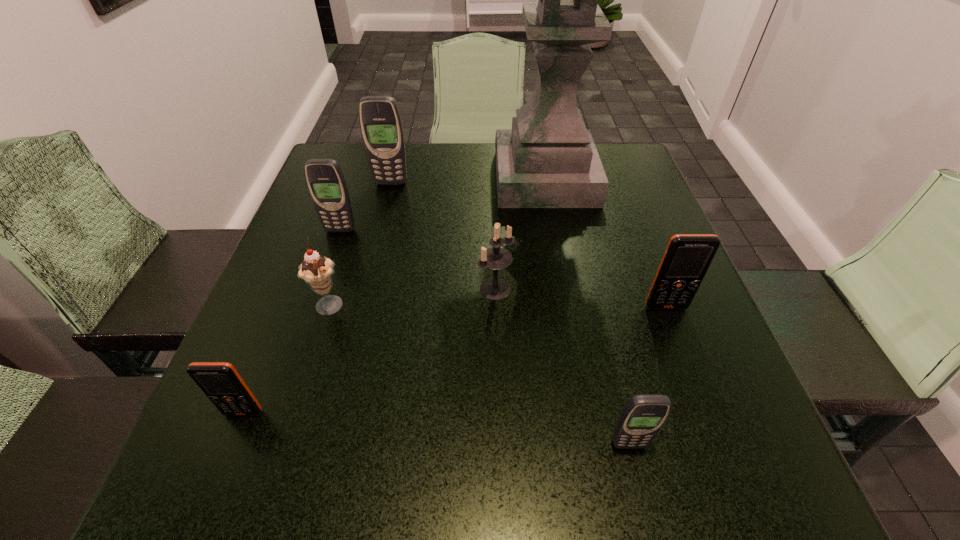
At what (x,y) coordinates should I click in order to perform the action: click on the left orange cellular telephone. Please return your answer as a coordinate pair (x, y). The width and height of the screenshot is (960, 540). Looking at the image, I should click on (221, 383).

Image resolution: width=960 pixels, height=540 pixels. I want to click on the seventh farthest object, so click(x=221, y=383).

The width and height of the screenshot is (960, 540). I want to click on the nearest object, so [643, 416].

Where is `the rightmost gray cellular telephone`? The height and width of the screenshot is (540, 960). the rightmost gray cellular telephone is located at coordinates (643, 416).

Find the location of a particular element. vacant region located at the front opening of the sculpture is located at coordinates 423,178.

Find the location of a particular element. The image size is (960, 540). vacant space positioned at the front opening of the sculpture is located at coordinates (373, 178).

Locate an element on the screen. The height and width of the screenshot is (540, 960). vacant area located at the front opening of the sculpture is located at coordinates (381, 178).

At what (x,y) coordinates should I click in order to perform the action: click on free space located on the screen of the biggest gray cellular telephone. Please return your answer as a coordinate pair (x, y). Looking at the image, I should click on (375, 246).

Image resolution: width=960 pixels, height=540 pixels. Find the location of `free location located on the screen of the second smallest gray cellular telephone`. free location located on the screen of the second smallest gray cellular telephone is located at coordinates (326, 271).

Where is `vacant position located on the screen of the farther orange cellular telephone`? vacant position located on the screen of the farther orange cellular telephone is located at coordinates (709, 421).